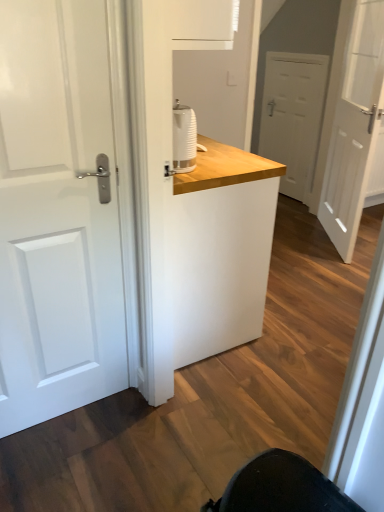
Question: Is white matte door at center, the 3th door positioned from the front, turned away from white matte door at right, acting as the 3th door starting from the left?

Choices:
 (A) yes
 (B) no

Answer: (B)

Question: Is white matte door at center, the 2th door in the left-to-right sequence, thinner than white matte door at right, arranged as the first door when viewed from the right?

Choices:
 (A) no
 (B) yes

Answer: (B)

Question: From a real-world perspective, is white matte door at center, which is the 2th door from right to left, on white matte door at right, the second door viewed from the front?

Choices:
 (A) yes
 (B) no

Answer: (B)

Question: Can you confirm if white matte door at center, the 2th door in the left-to-right sequence, is shorter than white matte door at right, which ranks as the 2th door in back-to-front order?

Choices:
 (A) yes
 (B) no

Answer: (A)

Question: From the image's perspective, does white matte door at center, the 2th door in the left-to-right sequence, appear higher than white matte door at right, the second door viewed from the front?

Choices:
 (A) no
 (B) yes

Answer: (B)

Question: From the image's perspective, is white glossy door at left, which is the 1th door in left-to-right order, positioned above or below white matte door at right, arranged as the first door when viewed from the right?

Choices:
 (A) above
 (B) below

Answer: (B)

Question: Visually, is white glossy door at left, which is the 3th door from back to front, positioned to the left or to the right of white matte door at right, which ranks as the 2th door in back-to-front order?

Choices:
 (A) right
 (B) left

Answer: (B)

Question: Considering the positions of white glossy door at left, which appears as the 3th door when viewed from the right, and white matte door at right, acting as the 3th door starting from the left, in the image, is white glossy door at left, which appears as the 3th door when viewed from the right, taller or shorter than white matte door at right, acting as the 3th door starting from the left,?

Choices:
 (A) short
 (B) tall

Answer: (A)

Question: Is white glossy door at left, which is the 1th door in left-to-right order, in front of or behind white matte door at right, acting as the 3th door starting from the left, in the image?

Choices:
 (A) front
 (B) behind

Answer: (A)

Question: In the image, is white matte door at right, the second door viewed from the front, positioned in front of or behind white matte door at center, which is the 2th door from right to left?

Choices:
 (A) behind
 (B) front

Answer: (B)

Question: In terms of size, does white matte door at right, arranged as the first door when viewed from the right, appear bigger or smaller than white matte door at center, the 3th door positioned from the front?

Choices:
 (A) big
 (B) small

Answer: (A)

Question: From a real-world perspective, is white matte door at right, arranged as the first door when viewed from the right, physically located above or below white matte door at center, which is the 2th door from right to left?

Choices:
 (A) above
 (B) below

Answer: (A)

Question: Considering the positions of point (344, 94) and point (283, 136), is point (344, 94) closer or farther from the camera than point (283, 136)?

Choices:
 (A) farther
 (B) closer

Answer: (B)

Question: Would you say white matte door at right, acting as the 3th door starting from the left, is to the left or to the right of white glossy door at left, which appears as the 3th door when viewed from the right, in the picture?

Choices:
 (A) left
 (B) right

Answer: (B)

Question: Looking at their shapes, would you say white matte door at right, which ranks as the 2th door in back-to-front order, is wider or thinner than white glossy door at left, which is the 1th door from front to back?

Choices:
 (A) wide
 (B) thin

Answer: (A)